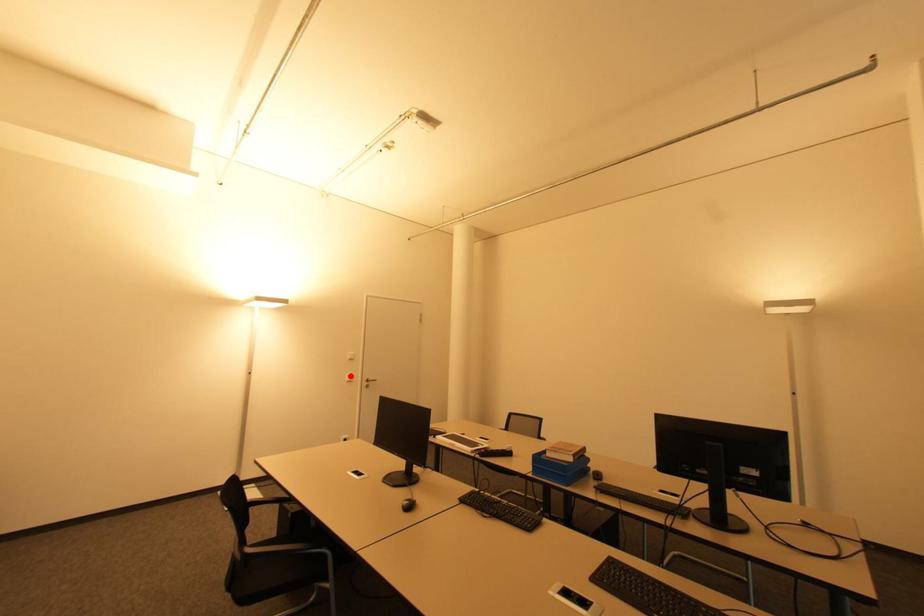
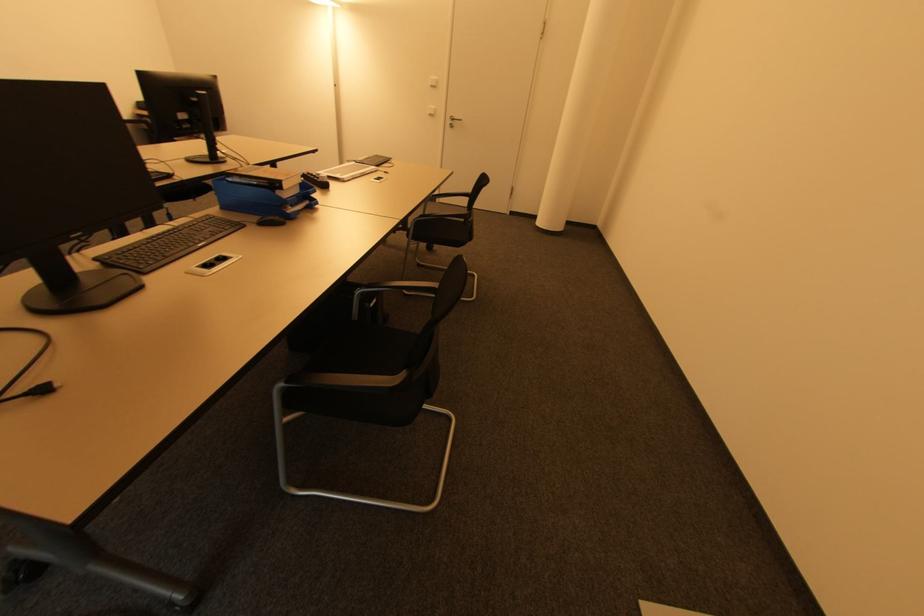
In the second image, find the point that corresponds to the highlighted location in the first image.

(433, 108)